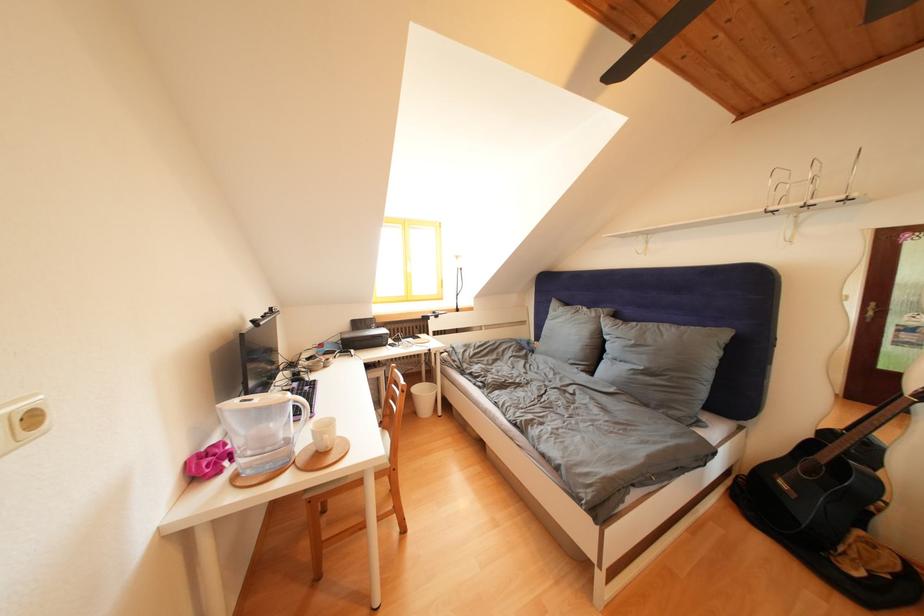
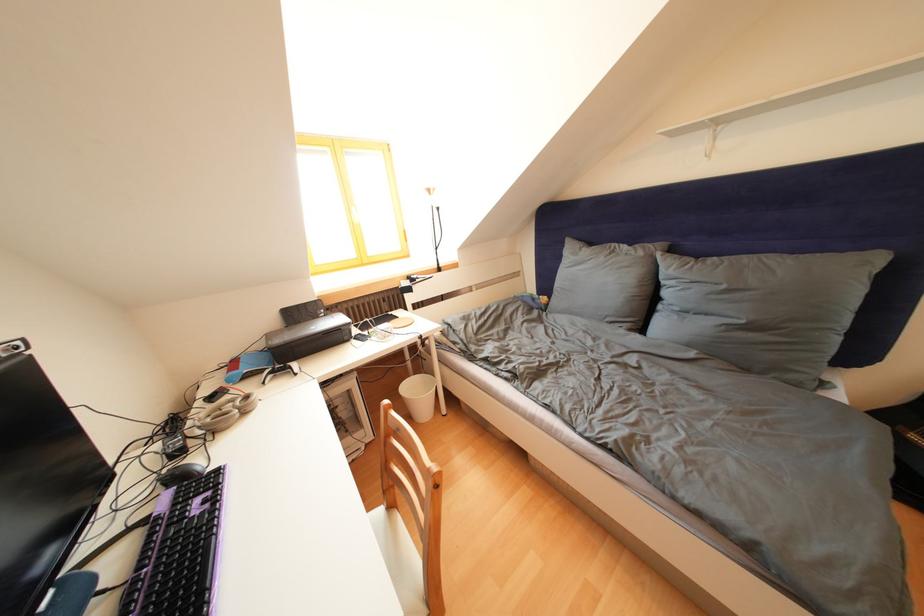
Question: The images are taken continuously from a first-person perspective. In which direction is your viewpoint rotating?

Choices:
 (A) Left
 (B) Right
 (C) Up
 (D) Down

Answer: (D)